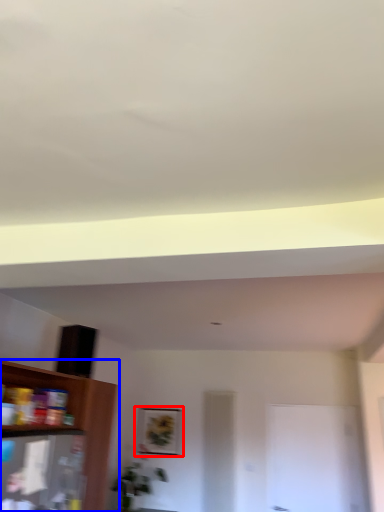
Question: Which object is closer to the camera taking this photo, picture frame (highlighted by a red box) or shelf (highlighted by a blue box)?

Choices:
 (A) picture frame
 (B) shelf

Answer: (B)